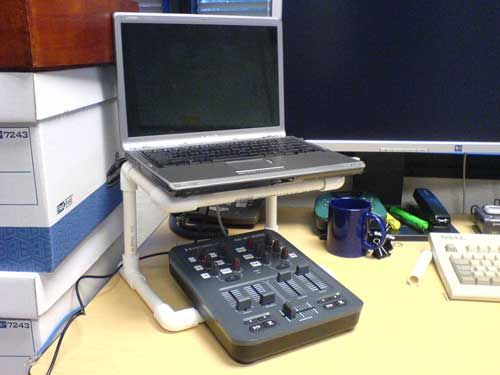
Locate an element on the screen. The image size is (500, 375). brown box is located at coordinates (74, 37).